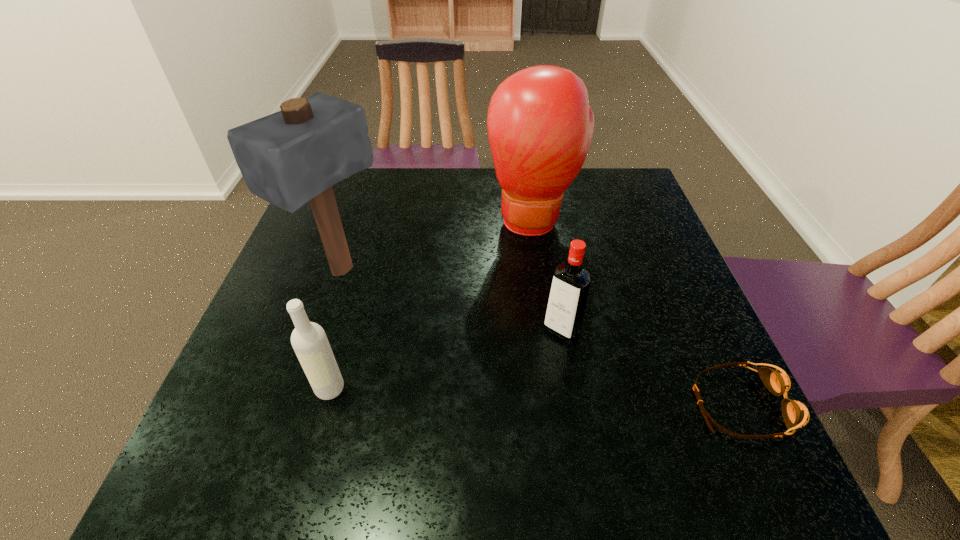
This screenshot has width=960, height=540. In order to click on the left vodka in this screenshot , I will do `click(309, 341)`.

The image size is (960, 540). Find the location of `goggles`. goggles is located at coordinates (795, 414).

Where is `the rightmost object`? The height and width of the screenshot is (540, 960). the rightmost object is located at coordinates (795, 414).

Where is `mallet`? mallet is located at coordinates (294, 156).

Locate an element on the screen. boxing glove is located at coordinates (540, 126).

Find the location of a particular element. This screenshot has width=960, height=540. the third farthest object is located at coordinates (570, 285).

You are a GUI agent. You are given a task and a screenshot of the screen. Output one action in this format:
    pyautogui.click(x=<x>, y=<y>)
    Task: Click on the right vodka
    This screenshot has height=540, width=960.
    Given the screenshot: What is the action you would take?
    pyautogui.click(x=570, y=285)

Identify the location of vacant position located 0.080m on the back of the left vodka. Image resolution: width=960 pixels, height=540 pixels. (343, 343).

The width and height of the screenshot is (960, 540). I want to click on vacant space located 0.070m on the striking surface of the mallet, so click(398, 303).

You are a GUI agent. You are given a task and a screenshot of the screen. Output one action in this format:
    pyautogui.click(x=<x>, y=<y>)
    Task: Click on the vacant region located 0.180m on the striking surface of the mallet
    This screenshot has width=960, height=540.
    Given the screenshot: What is the action you would take?
    pyautogui.click(x=437, y=325)